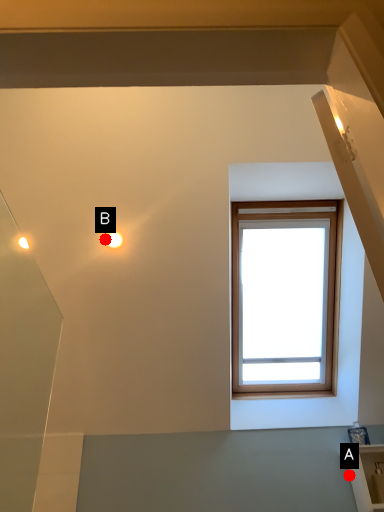
Question: Two points are circled on the image, labeled by A and B beside each circle. Which point is farther to the camera?

Choices:
 (A) A is further
 (B) B is further

Answer: (A)